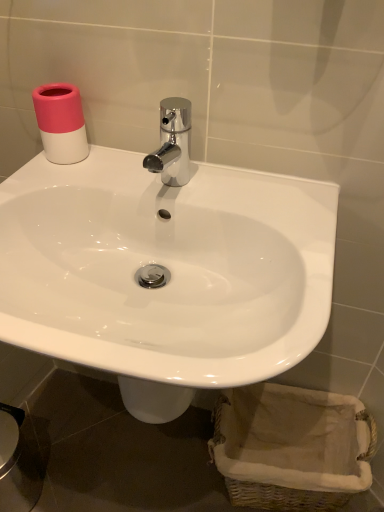
Question: Is point (188, 162) positioned closer to the camera than point (228, 253)?

Choices:
 (A) farther
 (B) closer

Answer: (A)

Question: From the image's perspective, relative to white glossy sink at center, is chrome metallic faucet at center above or below?

Choices:
 (A) below
 (B) above

Answer: (B)

Question: Which object is positioned closest to the woven beige basket at lower right?

Choices:
 (A) pink matte toilet paper at upper left
 (B) white glossy sink at center
 (C) chrome metallic faucet at center

Answer: (B)

Question: Which of these objects is positioned farthest from the woven beige basket at lower right?

Choices:
 (A) white glossy sink at center
 (B) pink matte toilet paper at upper left
 (C) chrome metallic faucet at center

Answer: (B)